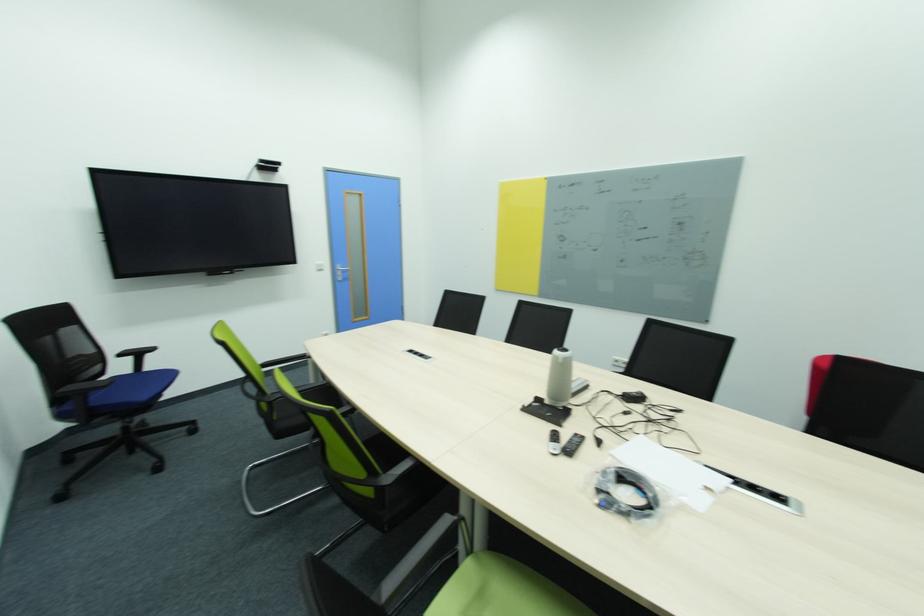
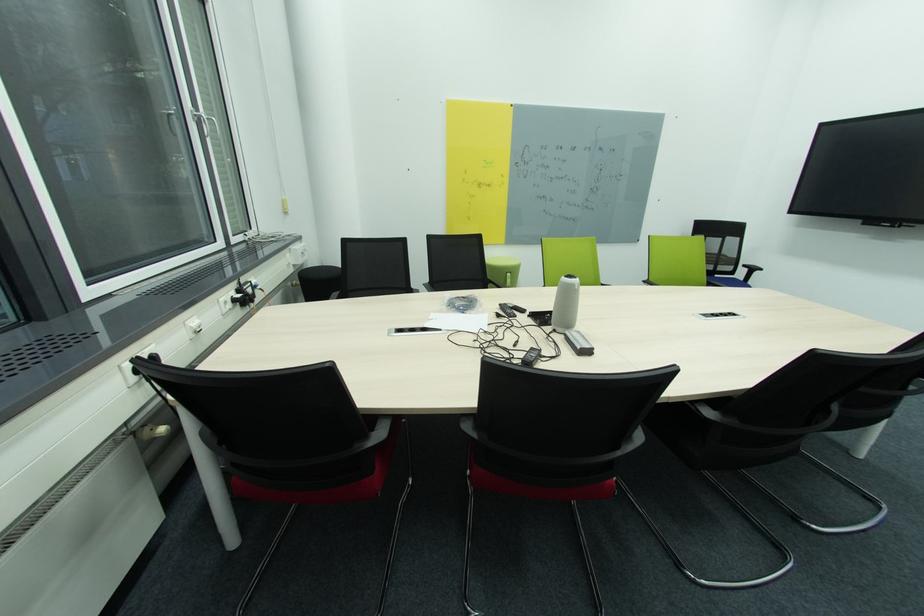
Locate, in the second image, the point that corresponds to (711,468) in the first image.

(444, 331)